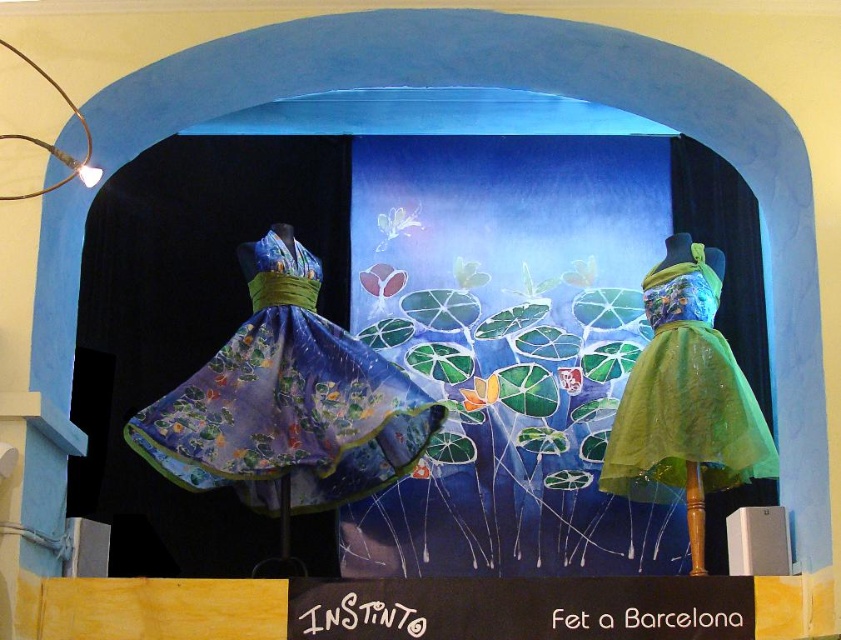
You are a fashion designer who wants to create a new collection inspired by underwater themes. You have two dresses in front of you, the shiny blue fabric dress at left and the green tulle dress at right. Which dress would you choose if you want to emphasize a bold and voluminous silhouette?

The shiny blue fabric dress at left is larger in size than the green tulle dress at right, so it would be the better choice to emphasize a bold and voluminous silhouette.